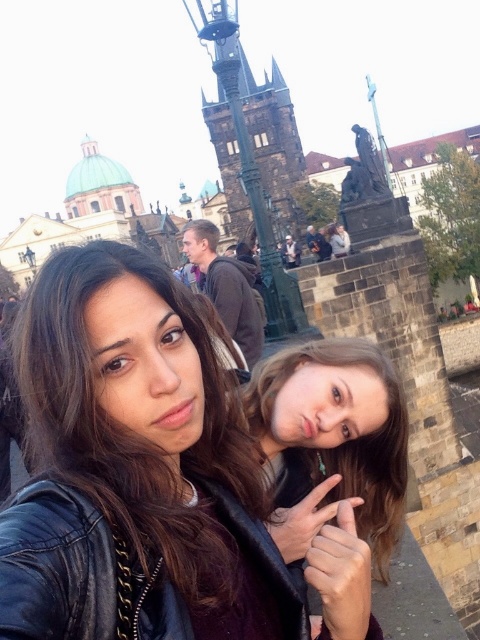
Can you confirm if matte black leather jacket at center is shorter than brown hair at center?

No, matte black leather jacket at center is not shorter than brown hair at center.

Based on the photo, who is lower down, matte black leather jacket at center or brown hair at center?

matte black leather jacket at center

In order to click on matte black leather jacket at center in this screenshot , I will do `click(133, 468)`.

Looking at this image, who is positioned more to the right, matte black leather jacket at center or brown leather jacket at center?

brown leather jacket at center is more to the right.

Is matte black leather jacket at center taller than brown leather jacket at center?

Indeed, matte black leather jacket at center has a greater height compared to brown leather jacket at center.

Between point (250, 452) and point (204, 275), which one is positioned in front?

Point (250, 452) is more forward.

At what (x,y) coordinates should I click in order to perform the action: click on matte black leather jacket at center. Please return your answer as a coordinate pair (x, y). Image resolution: width=480 pixels, height=640 pixels. Looking at the image, I should click on (133, 468).

Does dark brown stone tower at center have a greater height compared to brown leather jacket at center?

Correct, dark brown stone tower at center is much taller as brown leather jacket at center.

Between dark brown stone tower at center and brown leather jacket at center, which one appears on the right side from the viewer's perspective?

From the viewer's perspective, dark brown stone tower at center appears more on the right side.

The width and height of the screenshot is (480, 640). I want to click on dark brown stone tower at center, so click(x=251, y=132).